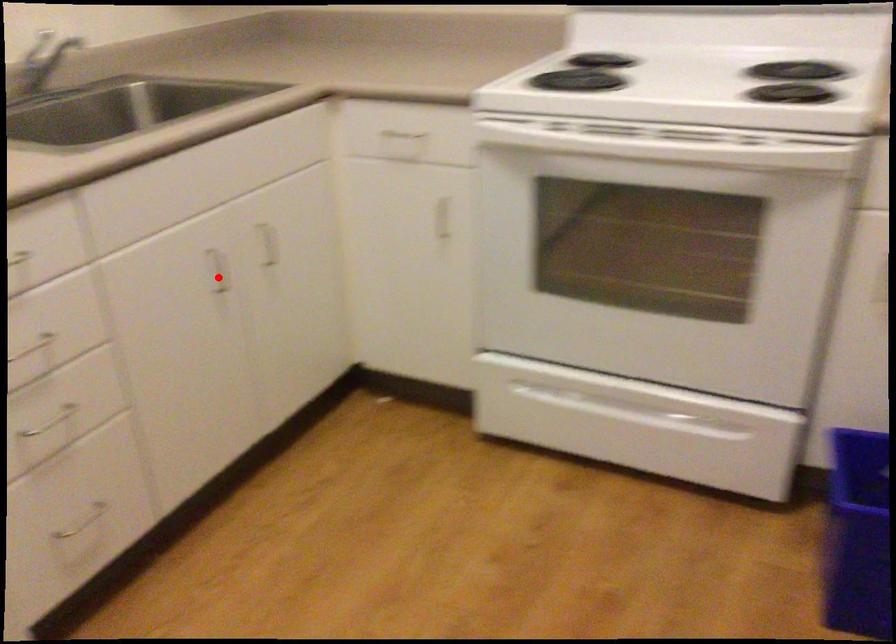
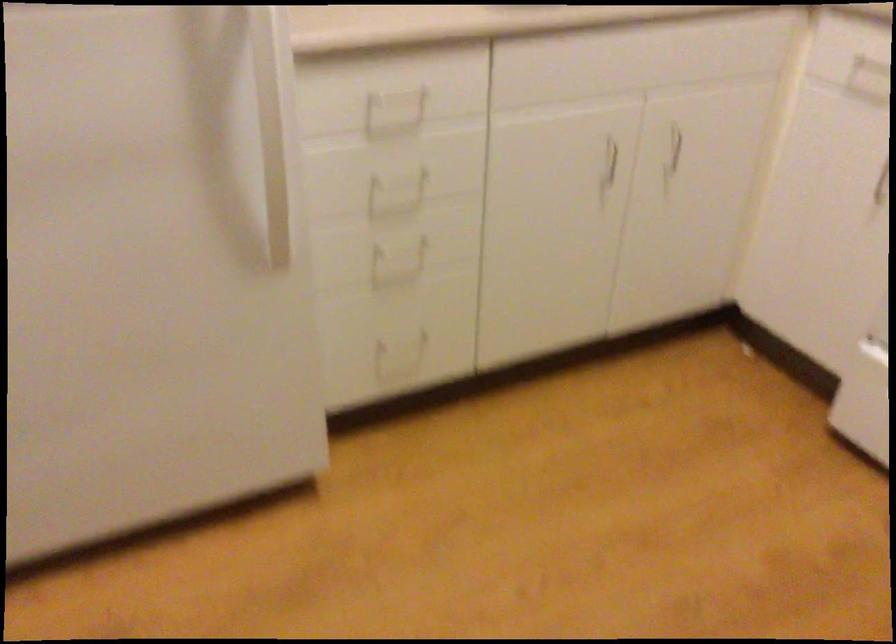
Locate, in the second image, the point that corresponds to the highlighted location in the first image.

(609, 161)